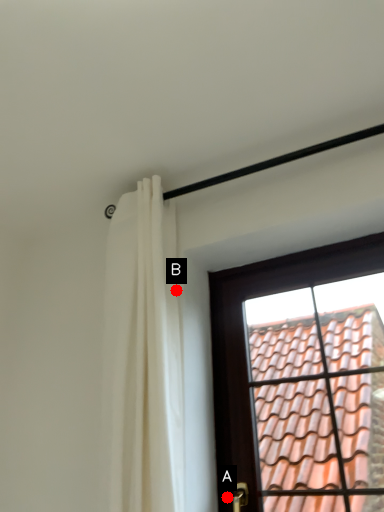
Question: Two points are circled on the image, labeled by A and B beside each circle. Which point appears closest to the camera in this image?

Choices:
 (A) A is closer
 (B) B is closer

Answer: (A)